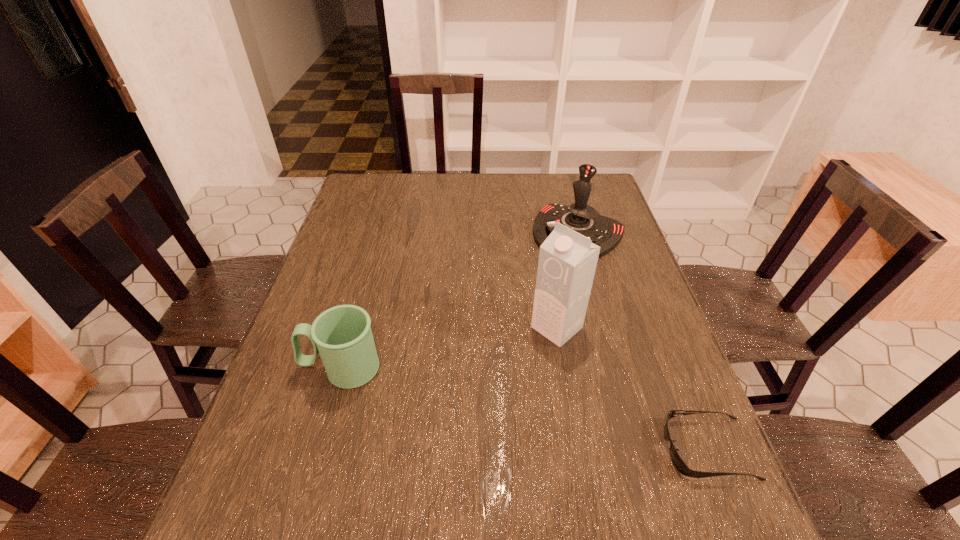
The width and height of the screenshot is (960, 540). I want to click on vacant space on the desktop that is between the second shortest object and the shortest object and is positioned on the handle side of the farthest object, so coord(471,397).

Locate an element on the screen. The height and width of the screenshot is (540, 960). vacant space on the desktop that is between the third farthest object and the sunglasses and is positioned on the front label of the third nearest object is located at coordinates (473, 397).